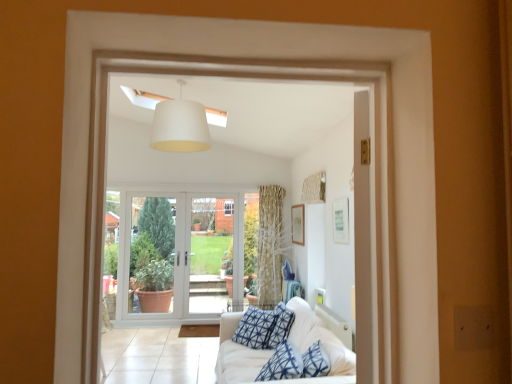
Question: From a real-world perspective, does white glass door at center, which is counted as the 2th screen door, starting from the left, stand above white matte lampshade at upper center?

Choices:
 (A) yes
 (B) no

Answer: (B)

Question: Considering the relative sizes of white glass door at center, the 1th screen door positioned from the right, and white matte lampshade at upper center in the image provided, is white glass door at center, the 1th screen door positioned from the right, thinner than white matte lampshade at upper center?

Choices:
 (A) no
 (B) yes

Answer: (B)

Question: Is white glass door at center, which is counted as the 2th screen door, starting from the left, facing away from white matte lampshade at upper center?

Choices:
 (A) no
 (B) yes

Answer: (A)

Question: Could white matte lampshade at upper center be considered to be inside white glass door at center, the 1th screen door positioned from the right?

Choices:
 (A) no
 (B) yes

Answer: (A)

Question: Is white glass door at center, the 1th screen door positioned from the right, positioned far away from white matte lampshade at upper center?

Choices:
 (A) no
 (B) yes

Answer: (B)

Question: From a real-world perspective, is white fabric couch at lower right positioned above or below white plastic window frame at center?

Choices:
 (A) above
 (B) below

Answer: (B)

Question: In the image, is white fabric couch at lower right positioned in front of or behind white plastic window frame at center?

Choices:
 (A) behind
 (B) front

Answer: (A)

Question: Based on their sizes in the image, would you say white fabric couch at lower right is bigger or smaller than white plastic window frame at center?

Choices:
 (A) small
 (B) big

Answer: (B)

Question: Does point (239, 374) appear closer or farther from the camera than point (283, 283)?

Choices:
 (A) closer
 (B) farther

Answer: (A)

Question: Based on their positions, is patterned fabric curtain at upper right located to the left or right of wooden picture frame at upper right, marked as the 1th picture frame in a left-to-right arrangement?

Choices:
 (A) right
 (B) left

Answer: (A)

Question: Is point (303, 185) positioned closer to the camera than point (302, 241)?

Choices:
 (A) farther
 (B) closer

Answer: (A)

Question: From the image's perspective, relative to wooden picture frame at upper right, the first picture frame from the back, is patterned fabric curtain at upper right above or below?

Choices:
 (A) below
 (B) above

Answer: (B)

Question: In terms of width, does patterned fabric curtain at upper right look wider or thinner when compared to wooden picture frame at upper right, marked as the 1th picture frame in a left-to-right arrangement?

Choices:
 (A) thin
 (B) wide

Answer: (B)

Question: In terms of width, does white glass door at center, which is counted as the 2th screen door, starting from the left, look wider or thinner when compared to white plastic window frame at center?

Choices:
 (A) thin
 (B) wide

Answer: (A)

Question: Choose the correct answer: Is white glass door at center, which is counted as the 2th screen door, starting from the left, inside white plastic window frame at center or outside it?

Choices:
 (A) inside
 (B) outside

Answer: (B)